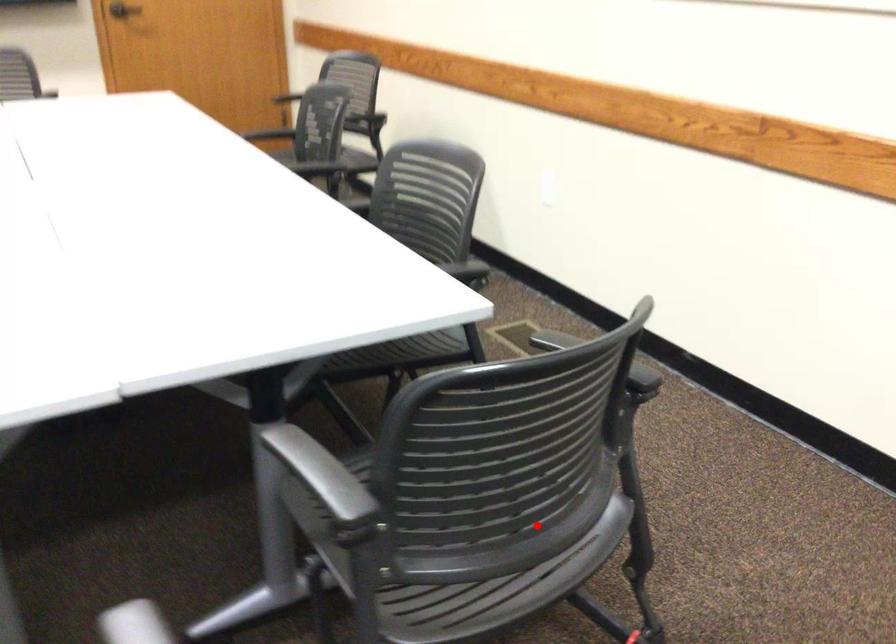
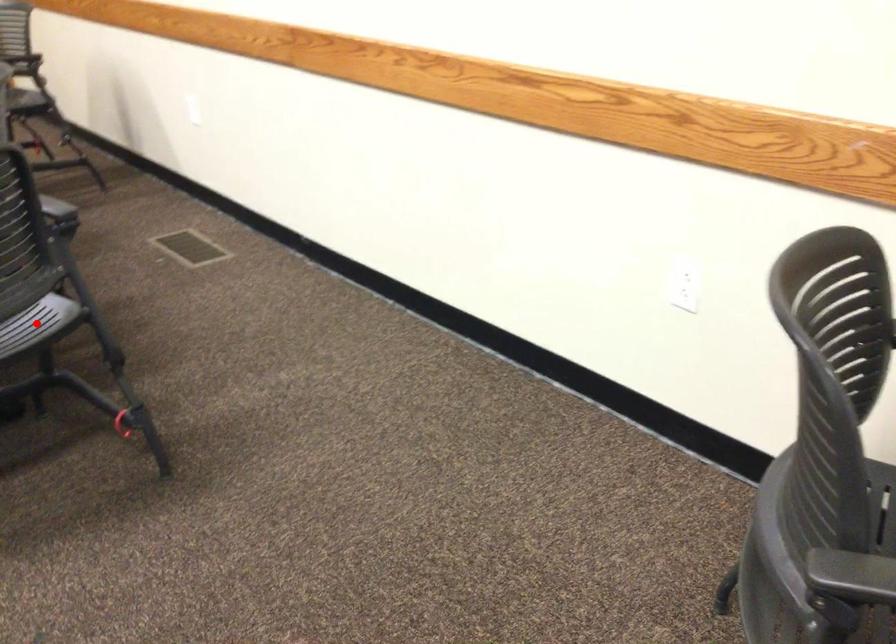
I am providing you with two images of the same scene from different viewpoints. A red point is marked on the first image and another point is marked on the second image. Do the highlighted points in image1 and image2 indicate the same real-world spot?

Yes